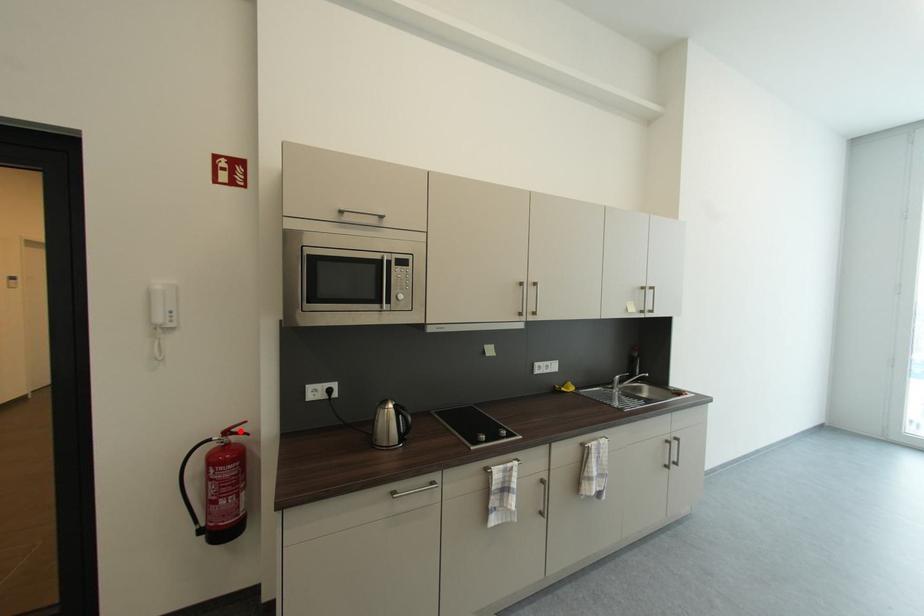
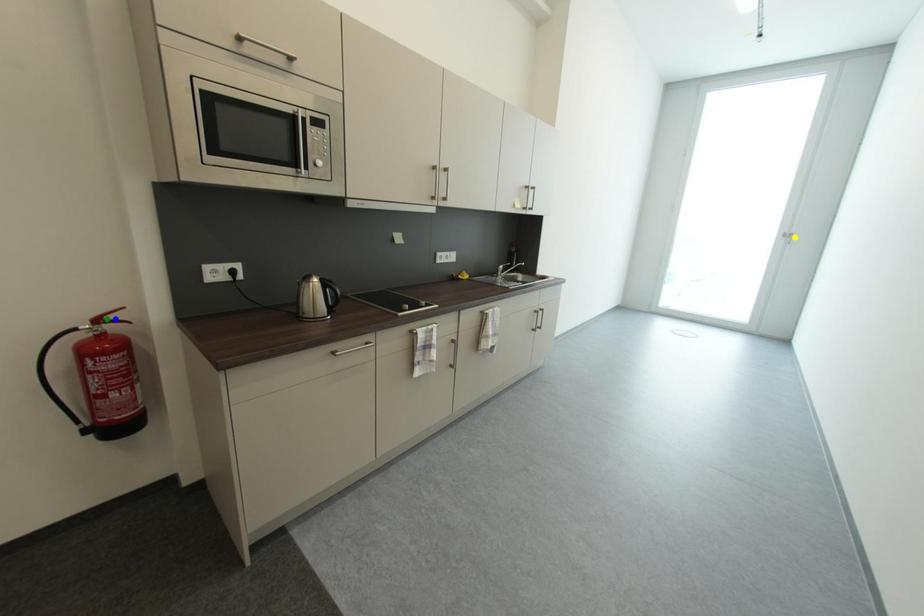
Question: I am providing you with two images of the same scene from different viewpoints. A red point is marked on the first image. You are given multiple points on the second image. In image 2, which mark is for the same physical point as the one in image 1?

Choices:
 (A) blue point
 (B) green point
 (C) yellow point

Answer: (A)